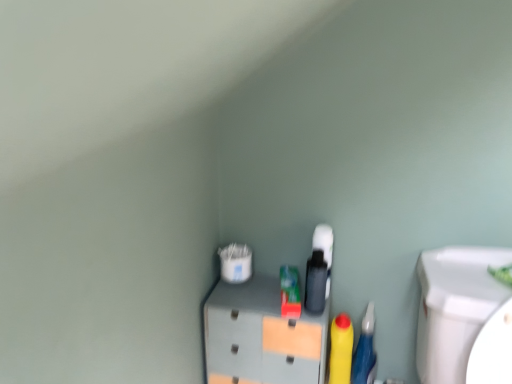
I want to click on free point above matte gray cabinet at center (from a real-world perspective), so click(x=264, y=297).